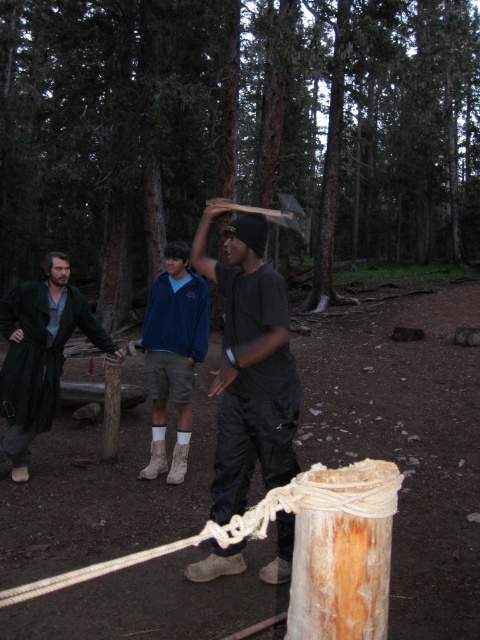
Question: Which of the following is the farthest from the observer?

Choices:
 (A) (55, 372)
 (B) (109, 61)

Answer: (B)

Question: Is black matte shirt at center closer to the viewer compared to green wool coat at left?

Choices:
 (A) no
 (B) yes

Answer: (B)

Question: Which point appears closest to the camera in this image?

Choices:
 (A) (8, 300)
 (B) (162, 433)
 (C) (204, 269)
 (D) (373, 124)

Answer: (C)

Question: Estimate the real-world distances between objects in this image. Which object is closer to the green wool coat at left?

Choices:
 (A) black matte shirt at center
 (B) blue fleece jacket at center
 (C) brown wood post at center

Answer: (B)

Question: Is brown wood post at center smaller than black matte shirt at center?

Choices:
 (A) yes
 (B) no

Answer: (B)

Question: Is brown wood post at center above white rope at center?

Choices:
 (A) no
 (B) yes

Answer: (B)